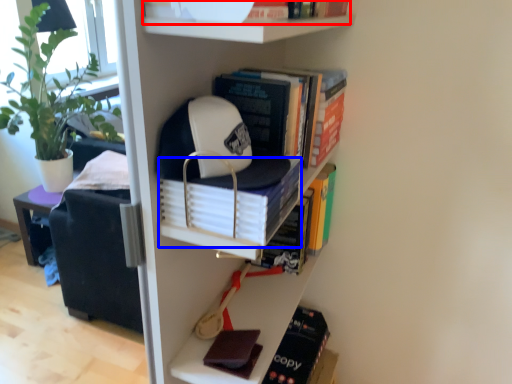
Question: Which of the following is the farthest to the observer, book (highlighted by a red box) or book (highlighted by a blue box)?

Choices:
 (A) book
 (B) book

Answer: (B)